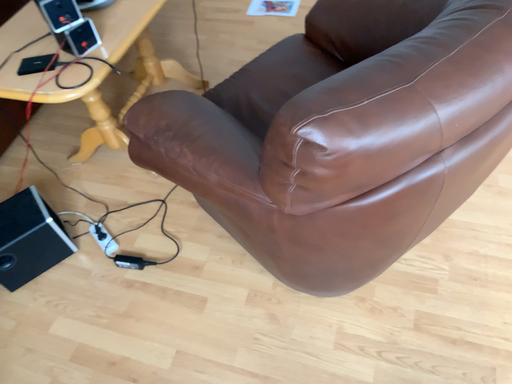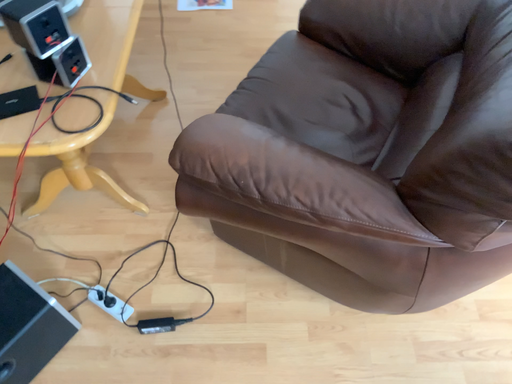
Question: How did the camera likely rotate when shooting the video?

Choices:
 (A) rotated left
 (B) rotated right

Answer: (B)